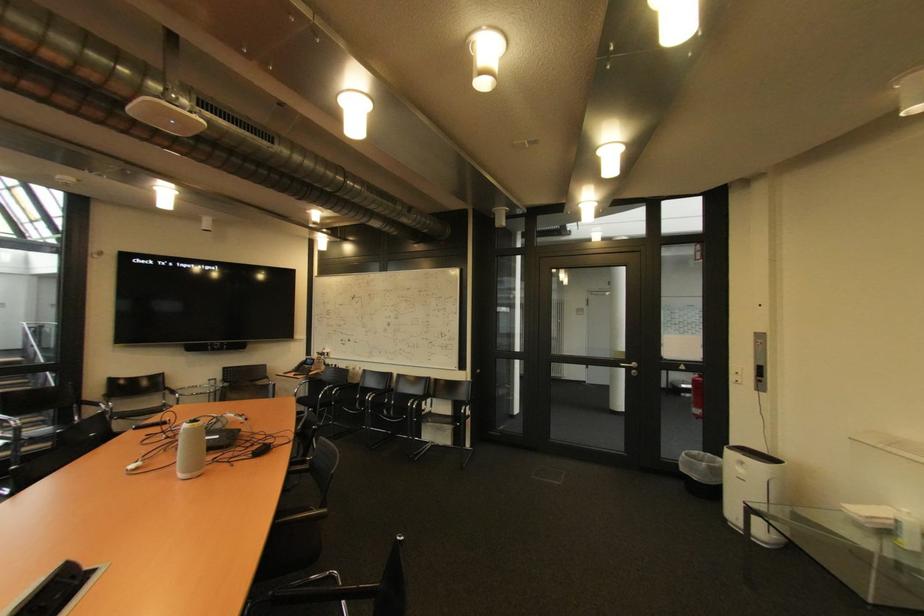
Where is `red fire extinguisher`? The width and height of the screenshot is (924, 616). red fire extinguisher is located at coordinates (697, 395).